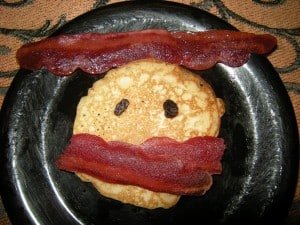
This screenshot has width=300, height=225. I want to click on embroidery, so click(x=280, y=30).